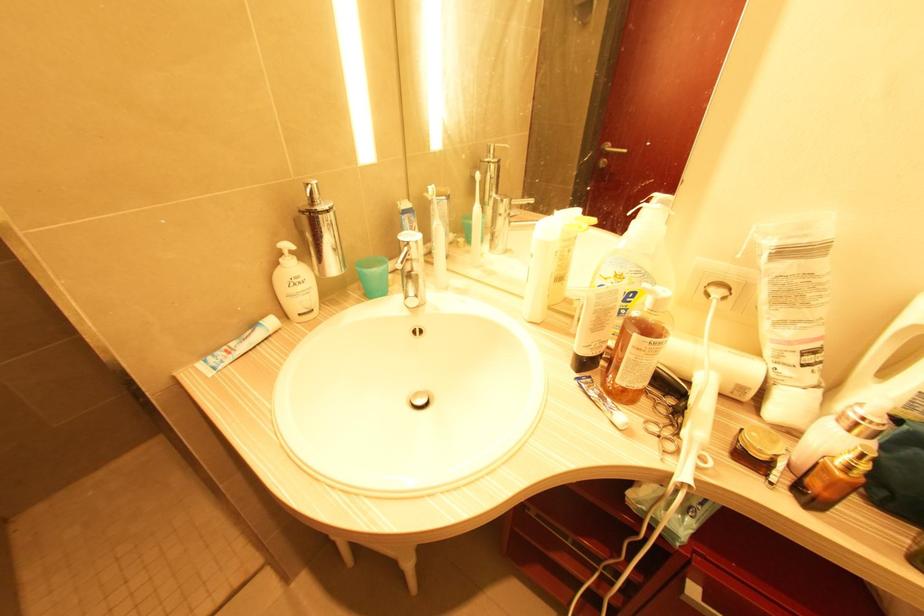
Which object does [438,241] point to?

It corresponds to the electric toothbrush in the image.